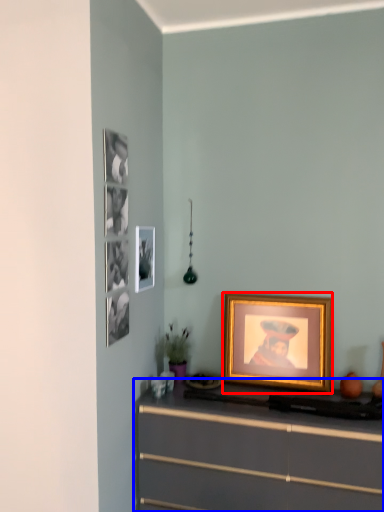
Question: Which object is further to the camera taking this photo, picture frame (highlighted by a red box) or chest of drawers (highlighted by a blue box)?

Choices:
 (A) picture frame
 (B) chest of drawers

Answer: (A)